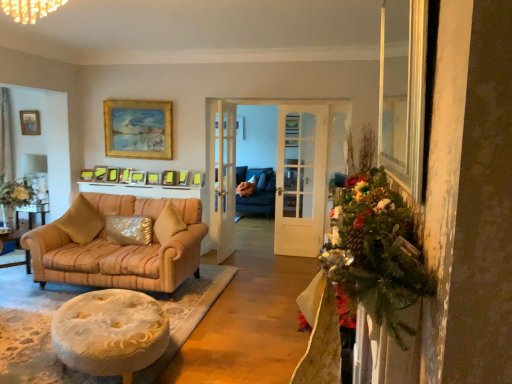
Question: Can you confirm if matte gold picture frame at center, the tenth picture frame from the left, is wider than matte gold picture frame at upper center, which is the 3th picture frame in left-to-right order?

Choices:
 (A) yes
 (B) no

Answer: (B)

Question: Can you confirm if matte gold picture frame at center, the 1th picture frame viewed from the right, is taller than matte gold picture frame at upper center, which is the 3th picture frame in left-to-right order?

Choices:
 (A) no
 (B) yes

Answer: (A)

Question: From a real-world perspective, is matte gold picture frame at center, the 1th picture frame viewed from the right, on matte gold picture frame at upper center, which is counted as the 8th picture frame, starting from the right?

Choices:
 (A) no
 (B) yes

Answer: (A)

Question: Is matte gold picture frame at center, the 1th picture frame viewed from the right, positioned in front of matte gold picture frame at upper center, which is counted as the 8th picture frame, starting from the right?

Choices:
 (A) yes
 (B) no

Answer: (A)

Question: Are matte gold picture frame at center, the 1th picture frame viewed from the right, and matte gold picture frame at upper center, which is the 3th picture frame in left-to-right order, making contact?

Choices:
 (A) no
 (B) yes

Answer: (A)

Question: From a real-world perspective, is velvet gold pillow at center, which is the first pillow from left to right, above or below matte gold picture frame at center, the tenth picture frame from the left?

Choices:
 (A) above
 (B) below

Answer: (B)

Question: Is point tap(83, 240) positioned closer to the camera than point tap(178, 183)?

Choices:
 (A) farther
 (B) closer

Answer: (B)

Question: Is velvet gold pillow at center, the 2th pillow from the right, inside the boundaries of matte gold picture frame at center, the tenth picture frame from the left, or outside?

Choices:
 (A) outside
 (B) inside

Answer: (A)

Question: From the image's perspective, is velvet gold pillow at center, which is the first pillow from left to right, above or below matte gold picture frame at center, the 1th picture frame viewed from the right?

Choices:
 (A) below
 (B) above

Answer: (A)

Question: Based on their sizes in the image, would you say matte gold picture frame at upper center, the 4th picture frame from the left, is bigger or smaller than matte gold picture frame at center, the tenth picture frame from the left?

Choices:
 (A) big
 (B) small

Answer: (A)

Question: Based on their positions, is matte gold picture frame at upper center, which is counted as the 7th picture frame, starting from the right, located to the left or right of matte gold picture frame at center, the tenth picture frame from the left?

Choices:
 (A) right
 (B) left

Answer: (B)

Question: Is point (109, 178) positioned closer to the camera than point (181, 175)?

Choices:
 (A) farther
 (B) closer

Answer: (A)

Question: Considering the positions of matte gold picture frame at upper center, the 4th picture frame from the left, and matte gold picture frame at center, the 1th picture frame viewed from the right, in the image, is matte gold picture frame at upper center, the 4th picture frame from the left, wider or thinner than matte gold picture frame at center, the 1th picture frame viewed from the right,?

Choices:
 (A) wide
 (B) thin

Answer: (A)

Question: From their relative heights in the image, would you say matte gold picture frame at center, the fourth picture frame from the right, is taller or shorter than white glossy lampshade at upper left?

Choices:
 (A) short
 (B) tall

Answer: (A)

Question: Considering the relative positions of matte gold picture frame at center, the seventh picture frame when ordered from left to right, and white glossy lampshade at upper left in the image provided, is matte gold picture frame at center, the seventh picture frame when ordered from left to right, to the left or to the right of white glossy lampshade at upper left?

Choices:
 (A) left
 (B) right

Answer: (B)